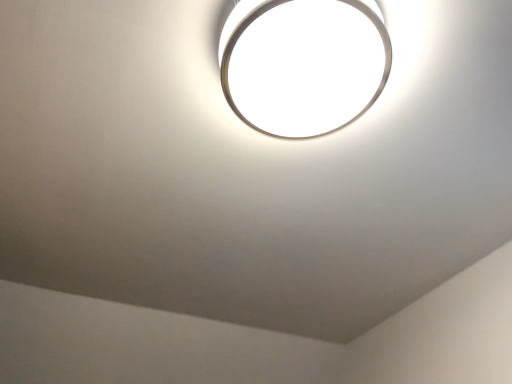
You are a GUI agent. You are given a task and a screenshot of the screen. Output one action in this format:
    pyautogui.click(x=<x>, y=<y>)
    Task: Click on the white glossy ring at upper center
    
    Given the screenshot: What is the action you would take?
    pyautogui.click(x=303, y=64)

Describe the element at coordinates (303, 64) in the screenshot. This screenshot has height=384, width=512. I see `white glossy ring at upper center` at that location.

This screenshot has height=384, width=512. Find the location of `white glossy ring at upper center`. white glossy ring at upper center is located at coordinates (303, 64).